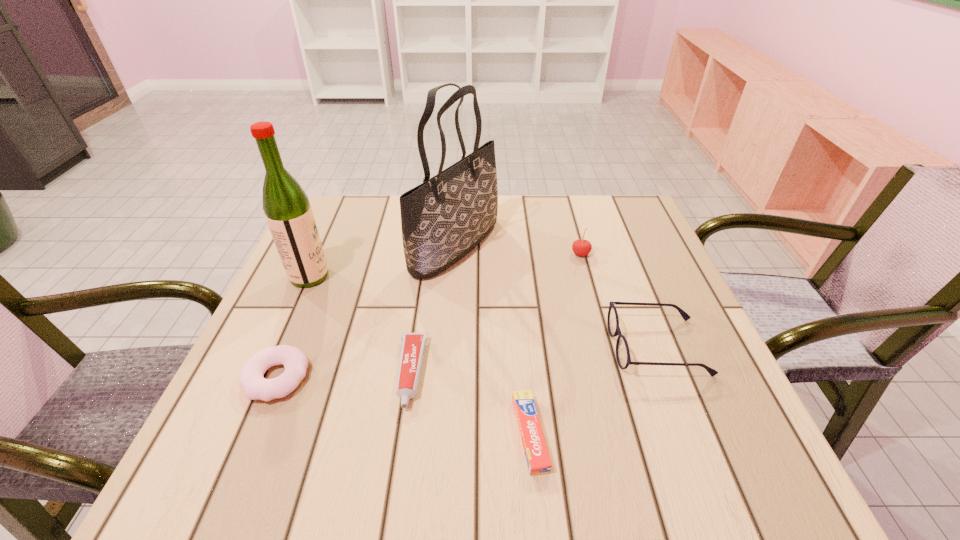
Locate an element on the screen. This screenshot has height=540, width=960. free space that is in between the doughnut and the taller toothpaste is located at coordinates (344, 375).

At what (x,y) coordinates should I click in order to perform the action: click on free space between the fourth tallest object and the third tallest object. Please return your answer as a coordinate pair (x, y). Looking at the image, I should click on (619, 300).

Find the location of `free space between the doughnut and the cherry`. free space between the doughnut and the cherry is located at coordinates (428, 315).

Where is `vacant space that is in between the taller toothpaste and the tote bag`? vacant space that is in between the taller toothpaste and the tote bag is located at coordinates click(x=433, y=309).

You are a GUI agent. You are given a task and a screenshot of the screen. Output one action in this format:
    pyautogui.click(x=<x>, y=<y>)
    Task: Click on the empty location between the taller toothpaste and the liquor
    The width and height of the screenshot is (960, 540).
    Given the screenshot: What is the action you would take?
    pyautogui.click(x=360, y=325)

You are a GUI agent. You are given a task and a screenshot of the screen. Output one action in this format:
    pyautogui.click(x=<x>, y=<y>)
    Task: Click on the free area in between the third tallest object and the fourth tallest object
    Image resolution: width=960 pixels, height=540 pixels.
    Given the screenshot: What is the action you would take?
    pyautogui.click(x=619, y=300)

This screenshot has height=540, width=960. I want to click on vacant space in between the liquor and the left toothpaste, so click(x=360, y=325).

Where is `object that is the fourth closest to the doughnut`? The height and width of the screenshot is (540, 960). object that is the fourth closest to the doughnut is located at coordinates (538, 461).

Locate an element on the screen. The height and width of the screenshot is (540, 960). object that ranks as the third closest to the fourth shortest object is located at coordinates tap(443, 219).

Where is `vacant space that satisfies the following two spatial constraints: 1. on the label of the right toothpaste; 2. on the left side of the liquor`? The image size is (960, 540). vacant space that satisfies the following two spatial constraints: 1. on the label of the right toothpaste; 2. on the left side of the liquor is located at coordinates (239, 434).